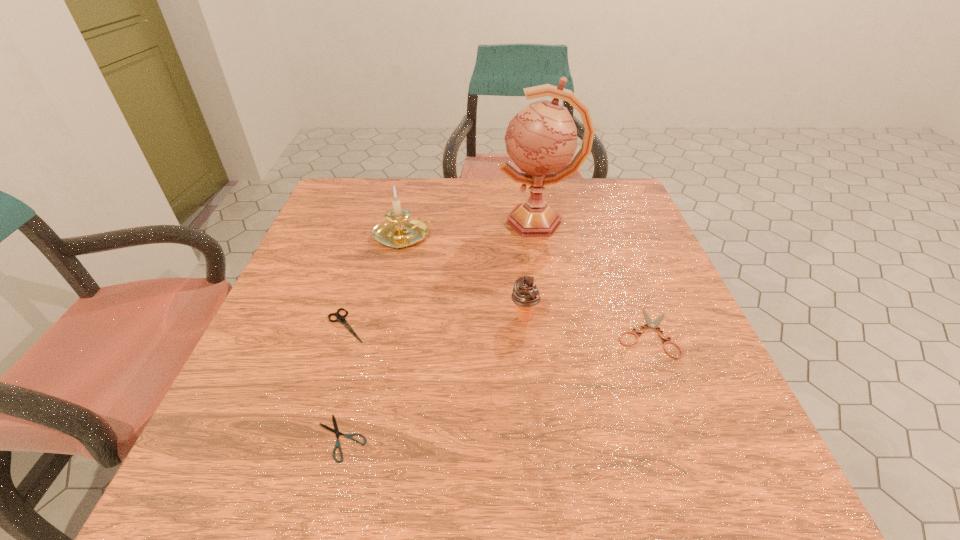
Locate an element on the screen. This screenshot has height=540, width=960. globe is located at coordinates (542, 137).

This screenshot has height=540, width=960. I want to click on the second tallest object, so click(397, 231).

Find the location of `icecream`. icecream is located at coordinates (525, 295).

The height and width of the screenshot is (540, 960). Identify the location of the fourth tallest object. pos(340,318).

The height and width of the screenshot is (540, 960). What are the coordinates of `the second shortest shears` in the screenshot? It's located at (654, 324).

This screenshot has height=540, width=960. I want to click on the second shortest object, so click(654, 324).

Where is `the shortest object`? The width and height of the screenshot is (960, 540). the shortest object is located at coordinates (x=336, y=431).

At what (x,y) coordinates should I click in order to perform the action: click on the nearest shears. Please return your answer as a coordinate pair (x, y). This screenshot has width=960, height=540. Looking at the image, I should click on (336, 431).

Find the location of `vacant space situated 0.350m on the front-facing side of the globe`. vacant space situated 0.350m on the front-facing side of the globe is located at coordinates (366, 222).

I want to click on vacant space located 0.130m on the front-facing side of the globe, so pos(448,222).